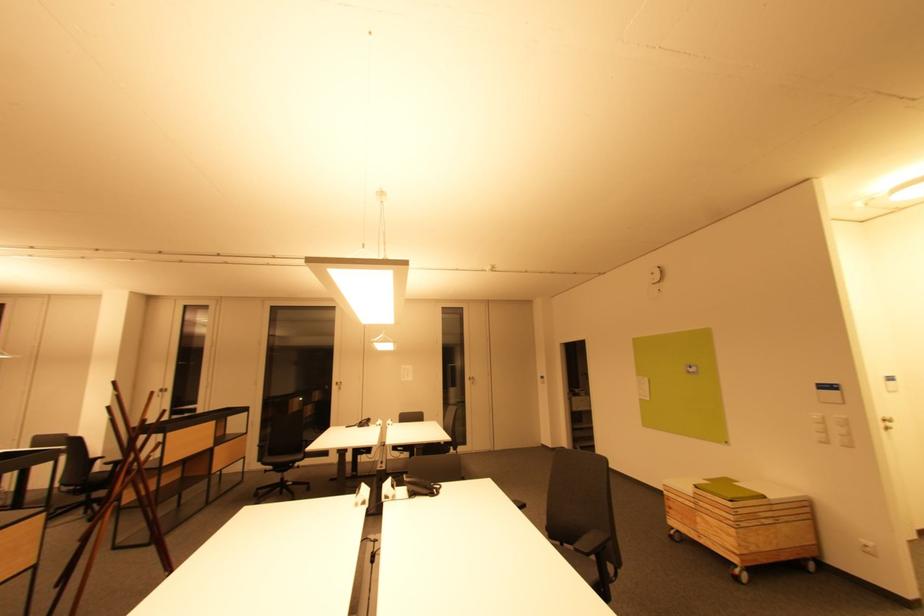
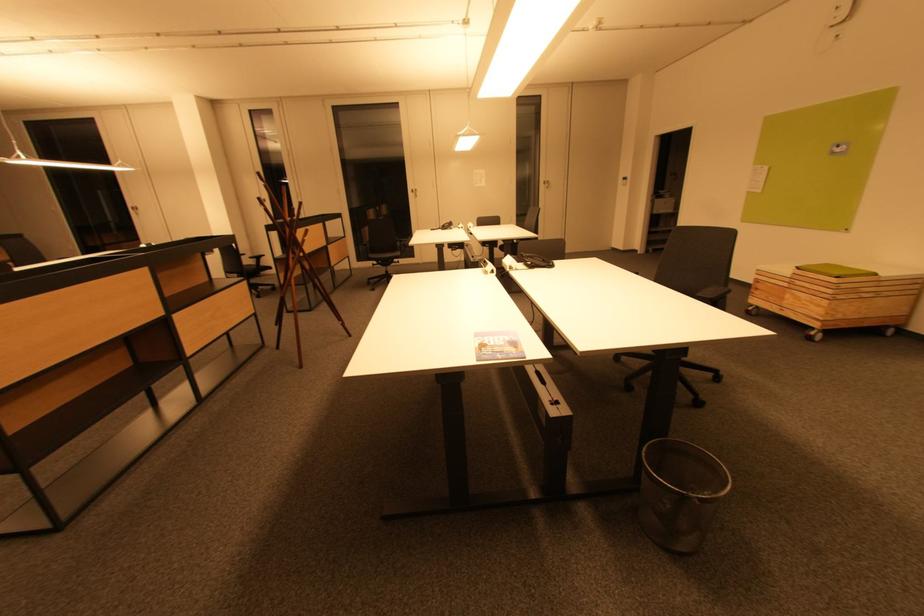
In the second image, find the point that corresponds to (x=345, y=384) in the first image.

(419, 191)